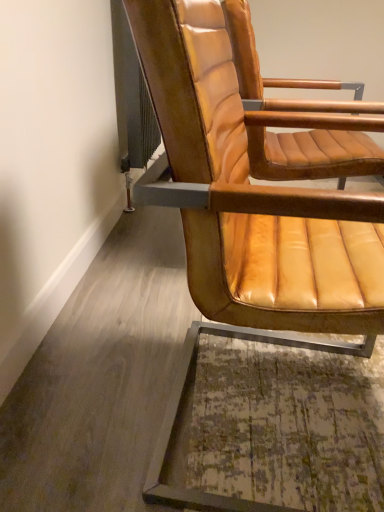
Question: Is tan leather chair at center, positioned as the second chair in front-to-back order, bigger or smaller than leather at right, the first chair viewed from the front?

Choices:
 (A) big
 (B) small

Answer: (B)

Question: From a real-world perspective, is tan leather chair at center, placed as the 1th chair when sorted from back to front, above or below leather at right, which is the 2th chair from back to front?

Choices:
 (A) above
 (B) below

Answer: (A)

Question: Considering the positions of point (236, 65) and point (253, 309), is point (236, 65) closer or farther from the camera than point (253, 309)?

Choices:
 (A) farther
 (B) closer

Answer: (A)

Question: From a real-world perspective, is leather at right, the first chair viewed from the front, above or below tan leather chair at center, placed as the 1th chair when sorted from back to front?

Choices:
 (A) above
 (B) below

Answer: (B)

Question: From the image's perspective, is leather at right, which is the 2th chair from back to front, positioned above or below tan leather chair at center, placed as the 1th chair when sorted from back to front?

Choices:
 (A) below
 (B) above

Answer: (A)

Question: In the image, is leather at right, the first chair viewed from the front, positioned in front of or behind tan leather chair at center, positioned as the second chair in front-to-back order?

Choices:
 (A) front
 (B) behind

Answer: (A)

Question: In terms of height, does leather at right, the first chair viewed from the front, look taller or shorter compared to tan leather chair at center, placed as the 1th chair when sorted from back to front?

Choices:
 (A) short
 (B) tall

Answer: (B)